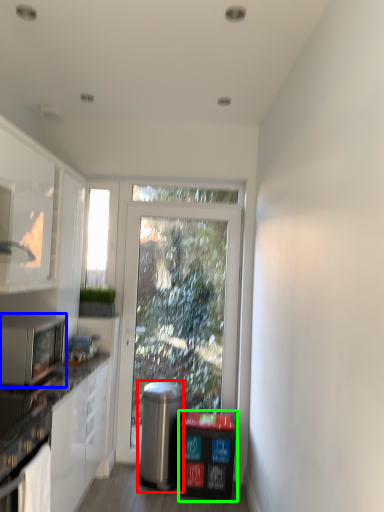
Question: Based on their relative distances, which object is nearer to appliance (highlighted by a red box)? Choose from microwave oven (highlighted by a blue box) and recycling bin (highlighted by a green box).

Choices:
 (A) microwave oven
 (B) recycling bin

Answer: (B)